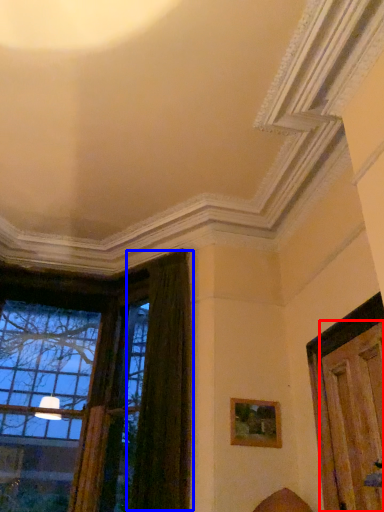
Question: Which object is closer to the camera taking this photo, door (highlighted by a red box) or curtain (highlighted by a blue box)?

Choices:
 (A) door
 (B) curtain

Answer: (A)